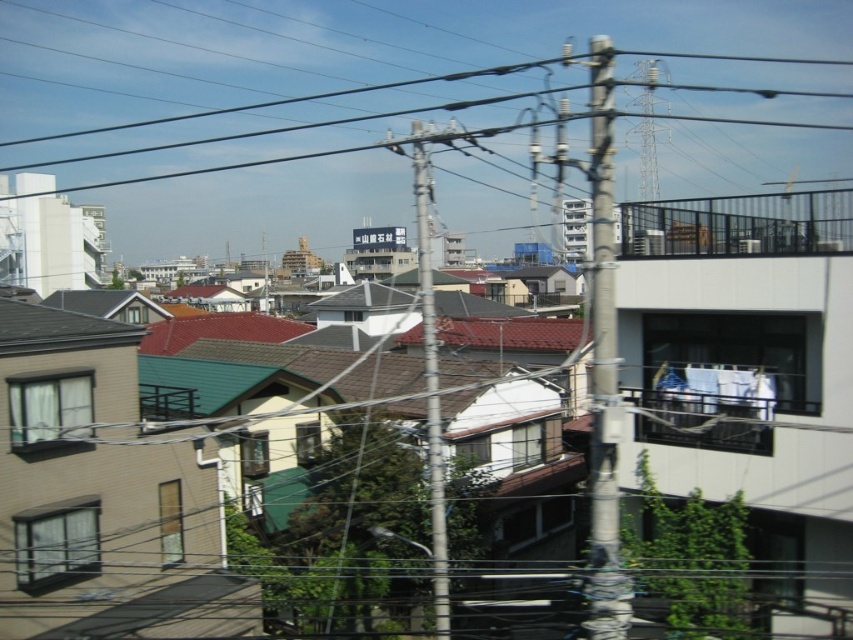
From the picture: Which is above, shiny black roof at upper left or brown tile roof at center?

shiny black roof at upper left is above.

Can you confirm if shiny black roof at upper left is shorter than brown tile roof at center?

Yes.

Identify the location of shiny black roof at upper left. This screenshot has width=853, height=640. (57, 330).

You are a GUI agent. You are given a task and a screenshot of the screen. Output one action in this format:
    pyautogui.click(x=<x>, y=<y>)
    Task: Click on the shiny black roof at upper left
    The height and width of the screenshot is (640, 853).
    Given the screenshot: What is the action you would take?
    pyautogui.click(x=57, y=330)

Does metallic gray telegraph pole at upper right lie behind brown tile roof at center?

No, it is in front of brown tile roof at center.

Which is behind, point (604, 244) or point (566, 328)?

The point (566, 328) is behind.

Locate an element on the screen. The height and width of the screenshot is (640, 853). metallic gray telegraph pole at upper right is located at coordinates (602, 365).

Does metallic gray telegraph pole at upper right appear on the right side of shiny black roof at upper left?

Correct, you'll find metallic gray telegraph pole at upper right to the right of shiny black roof at upper left.

How distant is metallic gray telegraph pole at upper right from shiny black roof at upper left?

metallic gray telegraph pole at upper right and shiny black roof at upper left are 8.70 meters apart.

Is point (596, 179) closer to camera compared to point (27, 328)?

Yes, point (596, 179) is in front of point (27, 328).

Where is `metallic gray telegraph pole at upper right`? The height and width of the screenshot is (640, 853). metallic gray telegraph pole at upper right is located at coordinates (602, 365).